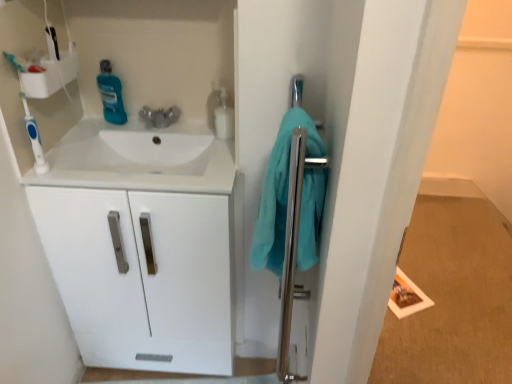
Locate an element on the screen. white plastic shelf at upper left is located at coordinates (51, 70).

Image resolution: width=512 pixels, height=384 pixels. What do you see at coordinates (34, 139) in the screenshot?
I see `blue plastic toothbrush at left` at bounding box center [34, 139].

What is the approximate height of white glossy cabinet at left?

86.71 centimeters.

Describe the element at coordinates (224, 118) in the screenshot. I see `translucent plastic bottle at upper center, which is counted as the second cleaning product, starting from the left` at that location.

Locate an element on the screen. Image resolution: width=512 pixels, height=384 pixels. white glossy sink at upper left is located at coordinates (139, 158).

In order to click on teal fabric towel at right in this screenshot , I will do `click(279, 193)`.

Can you tell me how much translucent plastic bottle at upper center, which is counted as the second cleaning product, starting from the left, and white plastic shelf at upper left differ in facing direction?

2.59 degrees separate the facing orientations of translucent plastic bottle at upper center, which is counted as the second cleaning product, starting from the left, and white plastic shelf at upper left.

From the image's perspective, is translucent plastic bottle at upper center, which is counted as the second cleaning product, starting from the left, located beneath white plastic shelf at upper left?

Indeed, from the image's perspective, translucent plastic bottle at upper center, which is counted as the second cleaning product, starting from the left, is shown beneath white plastic shelf at upper left.

Is translucent plastic bottle at upper center, which is counted as the second cleaning product, starting from the left, turned away from white plastic shelf at upper left?

No, white plastic shelf at upper left is not at the back of translucent plastic bottle at upper center, which is counted as the second cleaning product, starting from the left.

How different are the orientations of teal glossy mouthwash at upper left, the second cleaning product from the right, and white glossy cabinet at left in degrees?

teal glossy mouthwash at upper left, the second cleaning product from the right, and white glossy cabinet at left are facing 0.209 degrees away from each other.

From a real-world perspective, who is located higher, teal glossy mouthwash at upper left, the 1th cleaning product when ordered from left to right, or white glossy cabinet at left?

teal glossy mouthwash at upper left, the 1th cleaning product when ordered from left to right, from a real-world perspective.

Between teal glossy mouthwash at upper left, the 1th cleaning product when ordered from left to right, and white glossy cabinet at left, which one appears on the right side from the viewer's perspective?

white glossy cabinet at left is more to the right.

Would you say teal glossy mouthwash at upper left, the second cleaning product from the right, is inside or outside white glossy cabinet at left?

teal glossy mouthwash at upper left, the second cleaning product from the right, is not enclosed by white glossy cabinet at left.

Does white glossy sink at upper left have a lesser height compared to white plastic shelf at upper left?

Yes.

Consider the image. Who is bigger, white glossy sink at upper left or white plastic shelf at upper left?

white glossy sink at upper left.

Can you see white glossy sink at upper left touching white plastic shelf at upper left?

No, white glossy sink at upper left is not with white plastic shelf at upper left.

Which is in front, point (151, 156) or point (54, 61)?

The point (54, 61) is closer to the camera.

In the scene shown: Is translucent plastic bottle at upper center, acting as the first cleaning product starting from the right, completely or partially outside of polished chrome towel bar at right?

translucent plastic bottle at upper center, acting as the first cleaning product starting from the right, lies outside polished chrome towel bar at right's area.

The image size is (512, 384). What are the coordinates of `cleaning product that is the 1st one when counting backward from the polished chrome towel bar at right` in the screenshot? It's located at (224, 118).

Who is taller, translucent plastic bottle at upper center, which is counted as the second cleaning product, starting from the left, or polished chrome towel bar at right?

With more height is polished chrome towel bar at right.

Is polished chrome towel bar at right at the back of translucent plastic bottle at upper center, which is counted as the second cleaning product, starting from the left?

That's not correct — translucent plastic bottle at upper center, which is counted as the second cleaning product, starting from the left, is not looking away from polished chrome towel bar at right.

How much distance is there between teal fabric towel at right and translucent plastic bottle at upper center, acting as the first cleaning product starting from the right?

teal fabric towel at right is 38.99 centimeters from translucent plastic bottle at upper center, acting as the first cleaning product starting from the right.

Who is shorter, teal fabric towel at right or translucent plastic bottle at upper center, acting as the first cleaning product starting from the right?

translucent plastic bottle at upper center, acting as the first cleaning product starting from the right.

Is teal fabric towel at right wider or thinner than translucent plastic bottle at upper center, which is counted as the second cleaning product, starting from the left?

Considering their sizes, teal fabric towel at right looks broader than translucent plastic bottle at upper center, which is counted as the second cleaning product, starting from the left.

Is teal fabric towel at right to the left of translucent plastic bottle at upper center, which is counted as the second cleaning product, starting from the left, from the viewer's perspective?

No.

Would you say white plastic shelf at upper left is a long distance from teal glossy mouthwash at upper left, the second cleaning product from the right?

Actually, white plastic shelf at upper left and teal glossy mouthwash at upper left, the second cleaning product from the right, are a little close together.

Which is behind, white plastic shelf at upper left or teal glossy mouthwash at upper left, the 1th cleaning product when ordered from left to right?

teal glossy mouthwash at upper left, the 1th cleaning product when ordered from left to right, is more distant.

Is white plastic shelf at upper left positioned beyond the bounds of teal glossy mouthwash at upper left, the second cleaning product from the right?

That's correct, white plastic shelf at upper left is outside of teal glossy mouthwash at upper left, the second cleaning product from the right.

Which is more to the left, white plastic shelf at upper left or teal glossy mouthwash at upper left, the 1th cleaning product when ordered from left to right?

white plastic shelf at upper left is more to the left.

From the image's perspective, relative to translucent plastic bottle at upper center, which is counted as the second cleaning product, starting from the left, is polished chrome towel bar at right above or below?

Clearly, from the image's perspective, polished chrome towel bar at right is below translucent plastic bottle at upper center, which is counted as the second cleaning product, starting from the left.

Who is shorter, polished chrome towel bar at right or translucent plastic bottle at upper center, acting as the first cleaning product starting from the right?

translucent plastic bottle at upper center, acting as the first cleaning product starting from the right, is shorter.

Which point is more forward, (287, 321) or (216, 110)?

Positioned in front is point (287, 321).

Locate an element on the screen. This screenshot has width=512, height=384. shelf that is in front of the translucent plastic bottle at upper center, acting as the first cleaning product starting from the right is located at coordinates (51, 70).

Image resolution: width=512 pixels, height=384 pixels. What are the coordinates of `bathroom cabinet below the teal glossy mouthwash at upper left, the second cleaning product from the right (from the image's perspective)` in the screenshot? It's located at (144, 243).

Considering their positions, is teal glossy mouthwash at upper left, the 1th cleaning product when ordered from left to right, positioned further to teal fabric towel at right than white glossy sink at upper left?

Among the two, teal glossy mouthwash at upper left, the 1th cleaning product when ordered from left to right, is located further to teal fabric towel at right.

Estimate the real-world distances between objects in this image. Which object is closer to polished chrome towel bar at right, teal fabric towel at right or blue plastic toothbrush at left?

teal fabric towel at right.

From the image, which object appears to be nearer to polished chrome towel bar at right, teal glossy mouthwash at upper left, the second cleaning product from the right, or translucent plastic bottle at upper center, which is counted as the second cleaning product, starting from the left?

Among the two, translucent plastic bottle at upper center, which is counted as the second cleaning product, starting from the left, is located nearer to polished chrome towel bar at right.

Based on their spatial positions, is polished chrome towel bar at right or white glossy cabinet at left closer to teal fabric towel at right?

The object closer to teal fabric towel at right is polished chrome towel bar at right.

Which object lies further to the anchor point polished chrome towel bar at right, white glossy sink at upper left or teal fabric towel at right?

white glossy sink at upper left.

When comparing their distances from blue plastic toothbrush at left, does teal glossy mouthwash at upper left, the 1th cleaning product when ordered from left to right, or teal fabric towel at right seem further?

teal fabric towel at right.

Considering their positions, is polished chrome towel bar at right positioned closer to teal glossy mouthwash at upper left, the second cleaning product from the right, than blue plastic toothbrush at left?

Based on the image, blue plastic toothbrush at left appears to be nearer to teal glossy mouthwash at upper left, the second cleaning product from the right.

Based on their spatial positions, is teal glossy mouthwash at upper left, the 1th cleaning product when ordered from left to right, or white plastic shelf at upper left further from polished chrome towel bar at right?

teal glossy mouthwash at upper left, the 1th cleaning product when ordered from left to right.

Find the location of a particular element. The image size is (512, 384). bathroom cabinet situated between blue plastic toothbrush at left and translucent plastic bottle at upper center, acting as the first cleaning product starting from the right, from left to right is located at coordinates (x=144, y=243).

Find the location of `sink between blue plastic toothbrush at left and teal fabric towel at right in the horizontal direction`. sink between blue plastic toothbrush at left and teal fabric towel at right in the horizontal direction is located at coordinates (139, 158).

This screenshot has height=384, width=512. I want to click on cleaning product that lies between teal glossy mouthwash at upper left, the second cleaning product from the right, and white glossy cabinet at left from top to bottom, so click(224, 118).

Identify the location of sink between teal fabric towel at right and translucent plastic bottle at upper center, acting as the first cleaning product starting from the right, along the z-axis. The height and width of the screenshot is (384, 512). (139, 158).